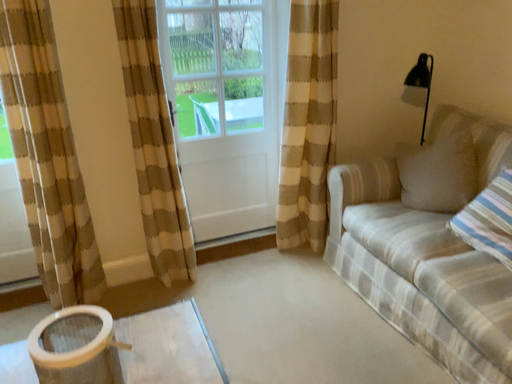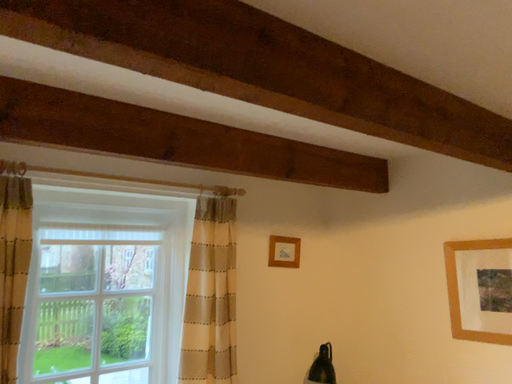
Question: How did the camera likely rotate when shooting the video?

Choices:
 (A) rotated right
 (B) rotated left

Answer: (A)